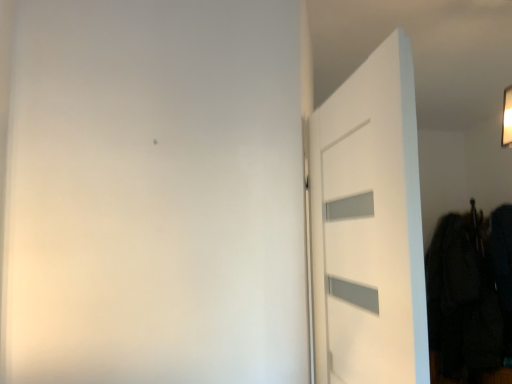
Question: Is dark fabric coat at right inside or outside of white matte door at right?

Choices:
 (A) outside
 (B) inside

Answer: (A)

Question: Is dark fabric coat at right to the left or to the right of white matte door at right in the image?

Choices:
 (A) left
 (B) right

Answer: (B)

Question: In terms of height, does dark fabric coat at right look taller or shorter compared to white matte door at right?

Choices:
 (A) short
 (B) tall

Answer: (B)

Question: Is white matte door at right inside or outside of dark fabric coat at right?

Choices:
 (A) inside
 (B) outside

Answer: (B)

Question: Would you say white matte door at right is to the left or to the right of dark fabric coat at right in the picture?

Choices:
 (A) left
 (B) right

Answer: (A)

Question: Based on their sizes in the image, would you say white matte door at right is bigger or smaller than dark fabric coat at right?

Choices:
 (A) small
 (B) big

Answer: (A)

Question: Considering the positions of white matte door at right and dark fabric coat at right in the image, is white matte door at right taller or shorter than dark fabric coat at right?

Choices:
 (A) tall
 (B) short

Answer: (B)